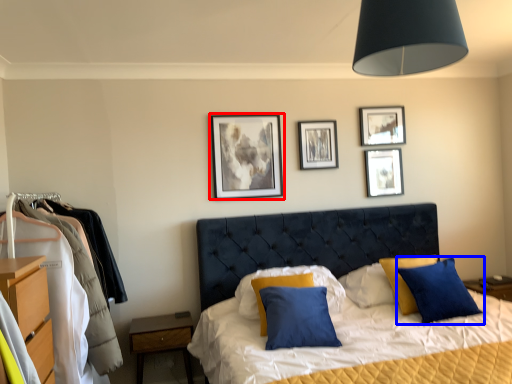
Question: Which object is further to the camera taking this photo, picture frame (highlighted by a red box) or pillow (highlighted by a blue box)?

Choices:
 (A) picture frame
 (B) pillow

Answer: (A)